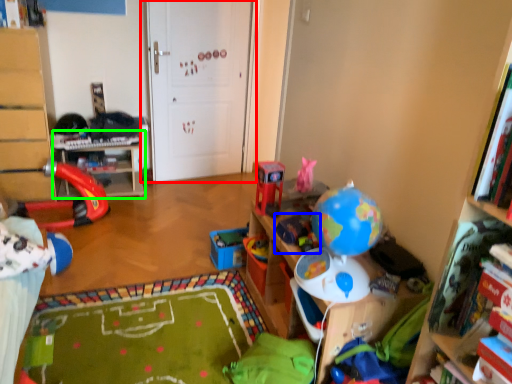
Question: Based on their relative distances, which object is farther from door (highlighted by a red box)? Choose from toy (highlighted by a blue box) and table (highlighted by a green box).

Choices:
 (A) toy
 (B) table

Answer: (A)